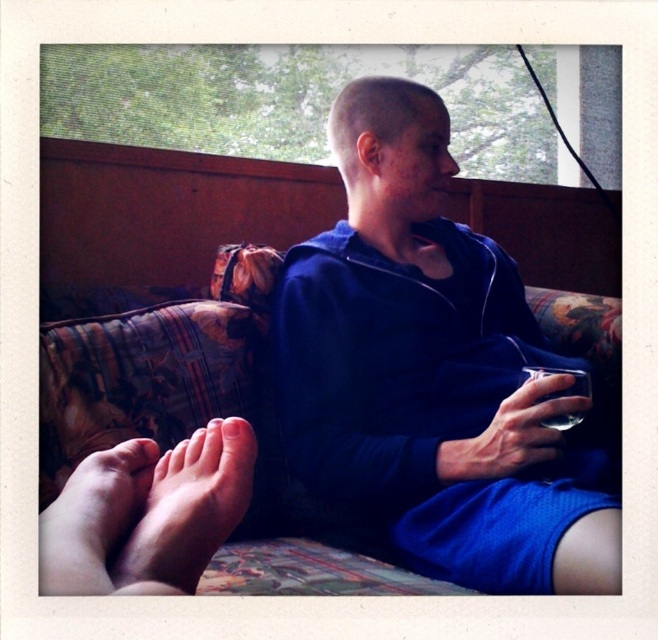
Is floral fabric couch at center above blue fabric shirt at center?

No, floral fabric couch at center is not above blue fabric shirt at center.

Is point (145, 337) less distant than point (413, 464)?

No, (145, 337) is further to viewer.

I want to click on floral fabric couch at center, so click(349, 401).

Does dry skin feet at lower left appear on the right side of pink soft skin at lower left?

Correct, you'll find dry skin feet at lower left to the right of pink soft skin at lower left.

Which is below, dry skin feet at lower left or pink soft skin at lower left?

Positioned lower is pink soft skin at lower left.

Between point (199, 554) and point (145, 448), which one is positioned in front?

Point (199, 554) is more forward.

Where is `dry skin feet at lower left`? dry skin feet at lower left is located at coordinates (190, 506).

Which is below, blue fabric shirt at center or dry skin feet at lower left?

dry skin feet at lower left is below.

This screenshot has height=640, width=658. Describe the element at coordinates (434, 372) in the screenshot. I see `blue fabric shirt at center` at that location.

Identify the location of blue fabric shirt at center. (434, 372).